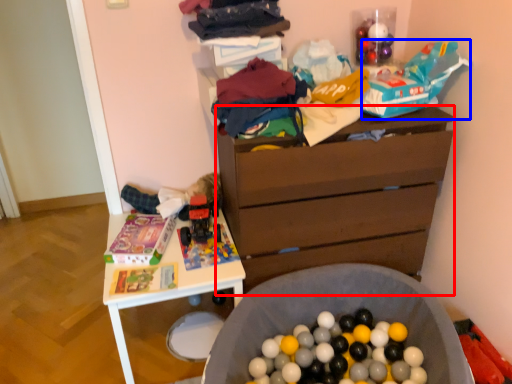
Question: Which of the following is the farthest to the observer, chest of drawers (highlighted by a red box) or toy (highlighted by a blue box)?

Choices:
 (A) chest of drawers
 (B) toy

Answer: (A)